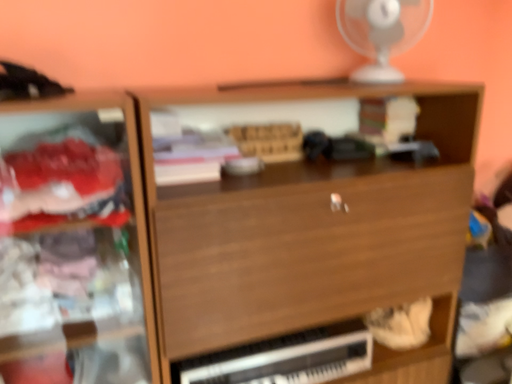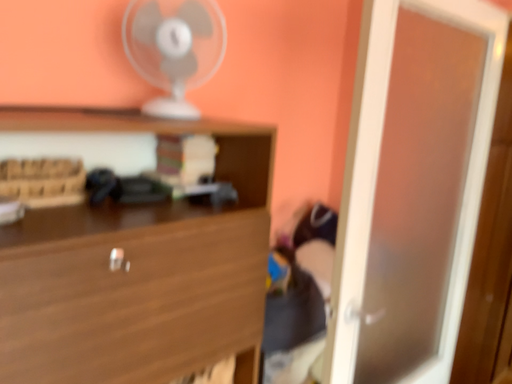
Question: How did the camera likely rotate when shooting the video?

Choices:
 (A) rotated left
 (B) rotated right

Answer: (B)